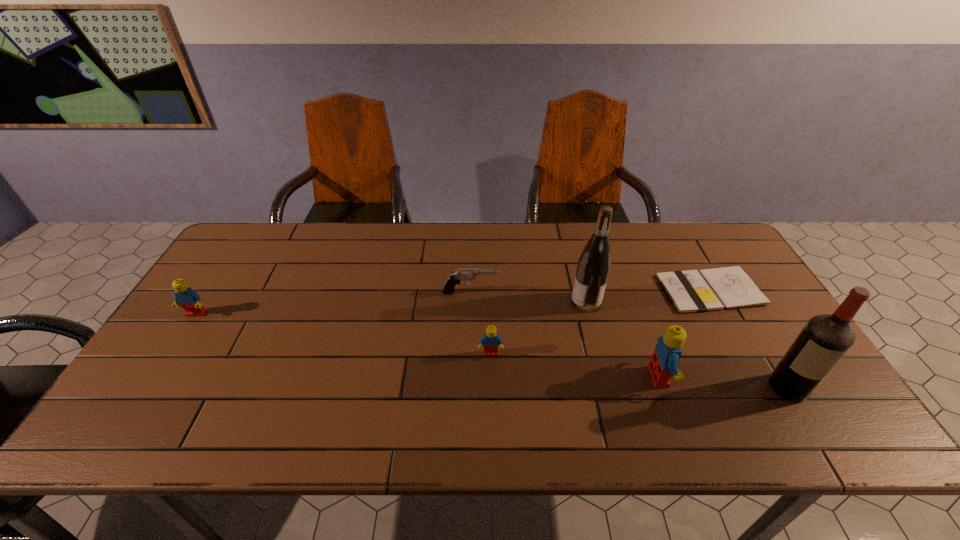
Where is `the leftmost Lego`? the leftmost Lego is located at coordinates (185, 296).

Locate an element on the screen. the second tallest Lego is located at coordinates (185, 296).

Where is `the second Lego from right to left`? the second Lego from right to left is located at coordinates (491, 340).

Where is `the fifth object from left to right`? the fifth object from left to right is located at coordinates (665, 359).

The image size is (960, 540). What are the coordinates of `the third tallest object` in the screenshot? It's located at (665, 359).

Locate an element on the screen. the shortest object is located at coordinates (705, 290).

At what (x,y) coordinates should I click in order to perform the action: click on wine bottle. Please return your answer as a coordinate pair (x, y). Looking at the image, I should click on (594, 263).

Where is `gun`? Image resolution: width=960 pixels, height=540 pixels. gun is located at coordinates (455, 278).

The width and height of the screenshot is (960, 540). Find the location of `liquor`. liquor is located at coordinates (825, 339).

The width and height of the screenshot is (960, 540). What are the coordinates of `vacant space situated on the face of the second tallest Lego` in the screenshot? It's located at (182, 335).